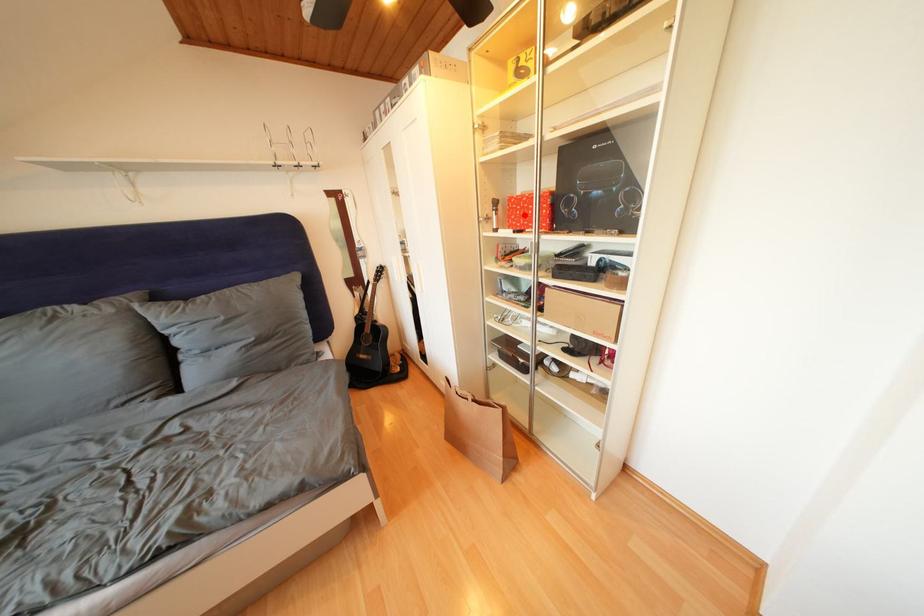
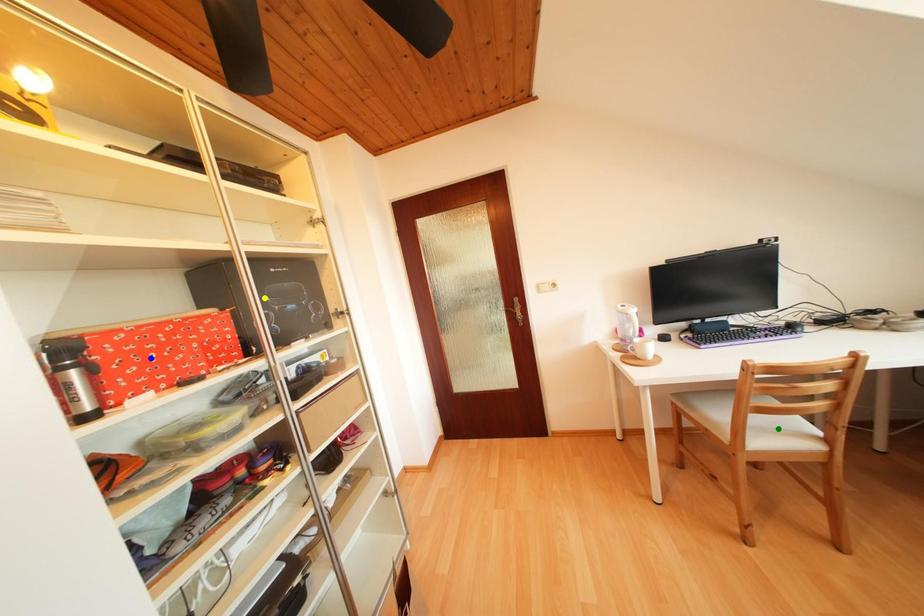
Question: I am providing you with two images of the same scene from different viewpoints. A red point is marked on the first image. You are given multiple points on the second image. Can you choose the point in image 2 that corresponds to the point in image 1?

Choices:
 (A) blue point
 (B) yellow point
 (C) green point

Answer: (A)